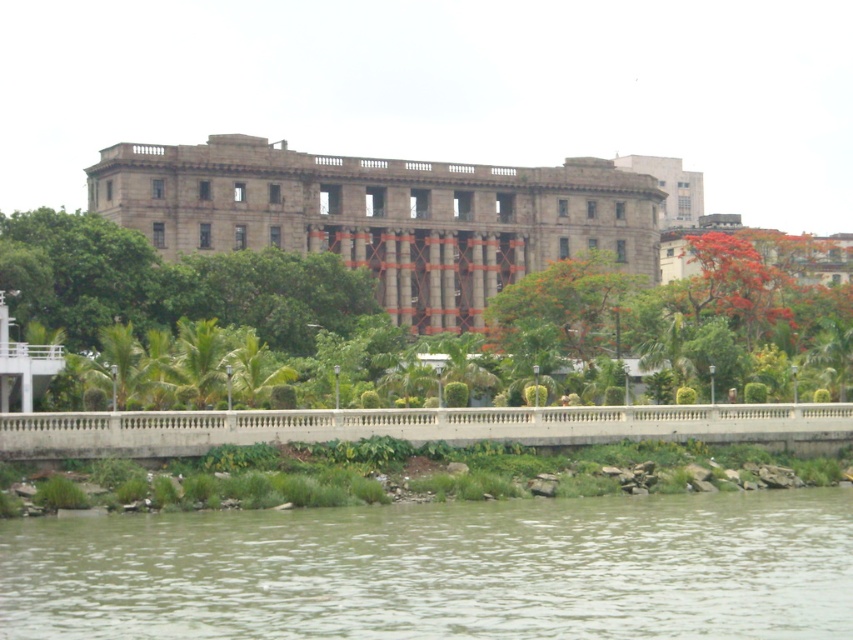
You are a tourist standing on the concrete wall near the water. You want to take a photo of the stone building at center while avoiding the brown sedimentary water at lower center from appearing too prominently in the frame. Which direction should you move to minimize the water in your photo?

The brown sedimentary water at lower center has a lesser width compared to the stone building at center. To minimize the water in your photo, move closer to the stone building at center so that the narrower water area is less visible in the frame.

You are a tourist standing on the concrete wall near the water. You want to take a photo of the stone building at center without including the brown sedimentary water at lower center in the frame. Is this possible given their sizes?

The brown sedimentary water at lower center occupies less space than the stone building at center. Therefore, since the water takes up less area in the image, it might be possible to frame the photo so that the stone building at center is the main focus while excluding the brown sedimentary water at lower center, depending on the camera angle and zoom.

You are standing at the point marked by point (442,570). What is the closest object to you in the scene?

The closest object to you is the brown sedimentary water at lower center, which is represented by point (442,570).